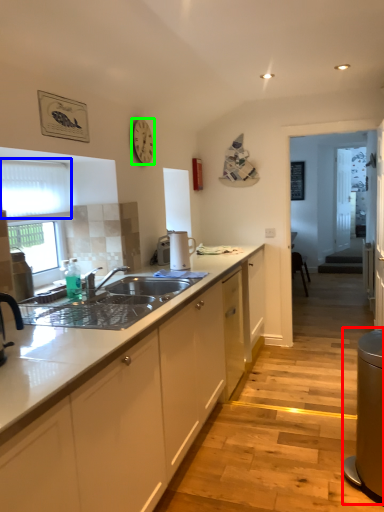
Question: Which is nearer to the appliance (highlighted by a red box)? window screen (highlighted by a blue box) or clock (highlighted by a green box).

Choices:
 (A) window screen
 (B) clock

Answer: (A)